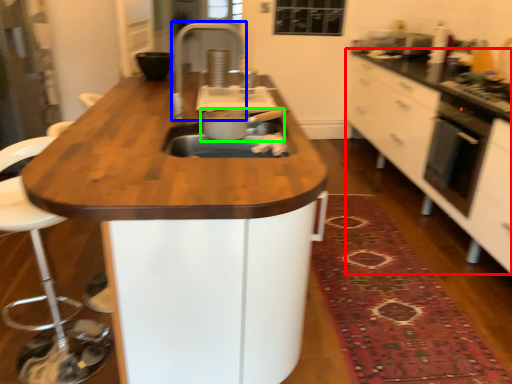
Question: Considering the real-world distances, which object is farthest from cabinetry (highlighted by a red box)? faucet (highlighted by a blue box) or kitchen appliance (highlighted by a green box)?

Choices:
 (A) faucet
 (B) kitchen appliance

Answer: (B)